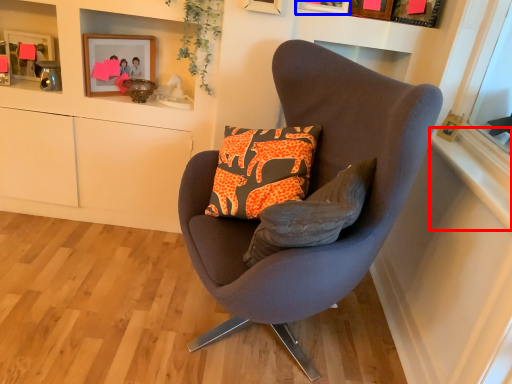
Question: Which object is further to the camera taking this photo, window sill (highlighted by a red box) or picture frame (highlighted by a blue box)?

Choices:
 (A) window sill
 (B) picture frame

Answer: (B)